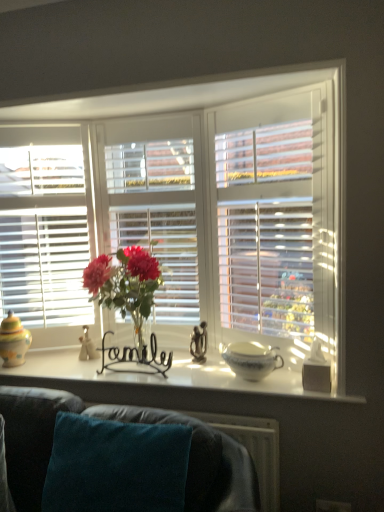
Identify the location of free space in front of white matte tissue box at right, placed as the 3th candle holder when sorted from left to right. (333, 396).